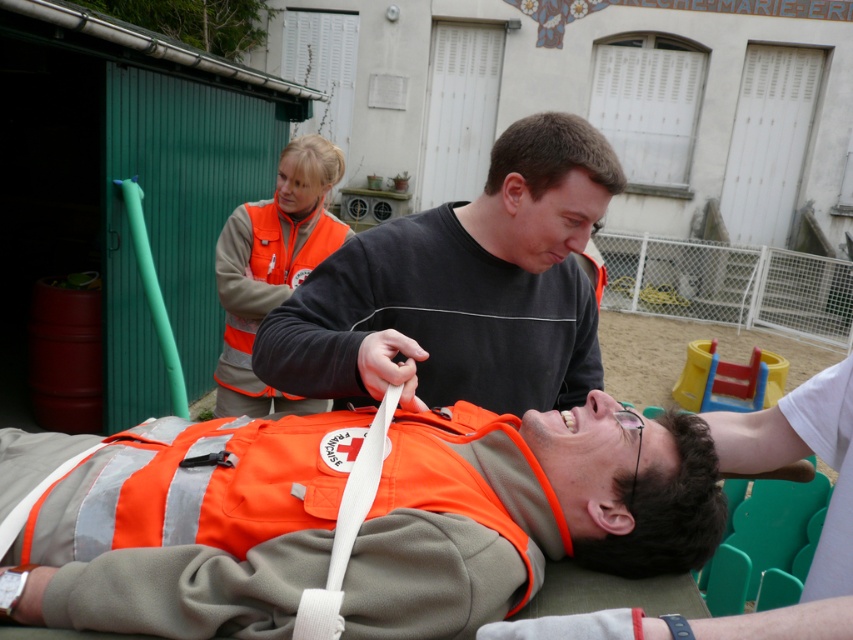
You are a drone operator tasked with capturing a closeup shot of the matte black shirt at center. The drone is currently positioned 1.5 meters away from the shirt. Can you safely move the drone closer to achieve the desired shot without violating the minimum safe distance of 1 meter?

The matte black shirt at center is 1.17 meters away from the camera. Since the drone is currently at 1.5 meters, moving it closer to 1.17 meters would still maintain a safe distance above the minimum requirement of 1 meter. Therefore, yes, you can move the drone closer to capture the closeup shot safely.

Looking at this image, you are a drone operator trying to deliver a medical kit to the person on the stretcher. The coordinates of the medical kit drop zone are at point (462, 289). Where should you drop the medical kit?

The point (462, 289) is on the matte black shirt at center, so you should drop the medical kit there.

You are a first responder assessing the scene. The matte black shirt at center and orange fabric vest at center are both visible. Which one appears bigger in size?

The matte black shirt at center has a larger size compared to orange fabric vest at center, so the matte black shirt at center appears bigger.